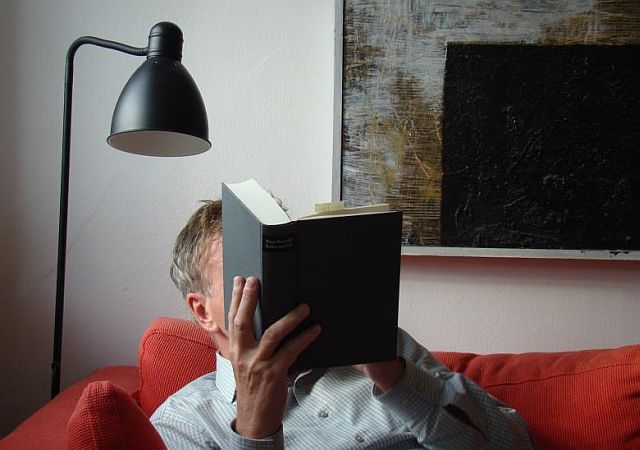
Find the location of a particular element. This screenshot has height=450, width=640. book cover is located at coordinates (244, 239), (326, 267), (281, 277).